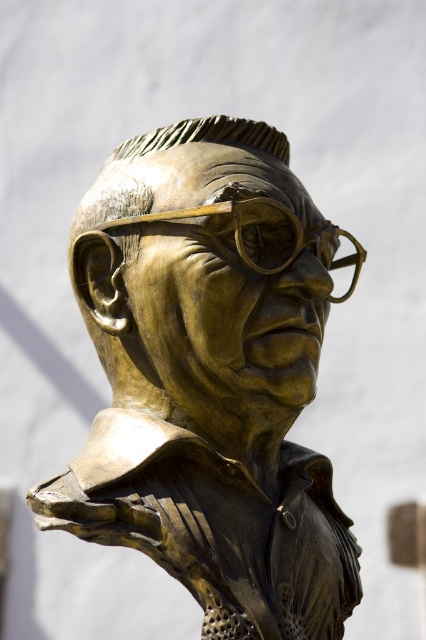
Is bronze statue at center closer to camera compared to gold textured goggles at center?

Yes.

Is bronze statue at center below gold textured goggles at center?

No.

I want to click on bronze statue at center, so click(157, 150).